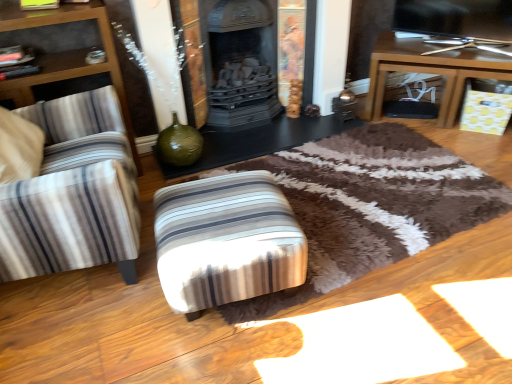
Image resolution: width=512 pixels, height=384 pixels. Find the location of `empty space that is ontop of black glossy table at center, which is the 2th table from right to left (from a real-world perspective)`. empty space that is ontop of black glossy table at center, which is the 2th table from right to left (from a real-world perspective) is located at coordinates (269, 127).